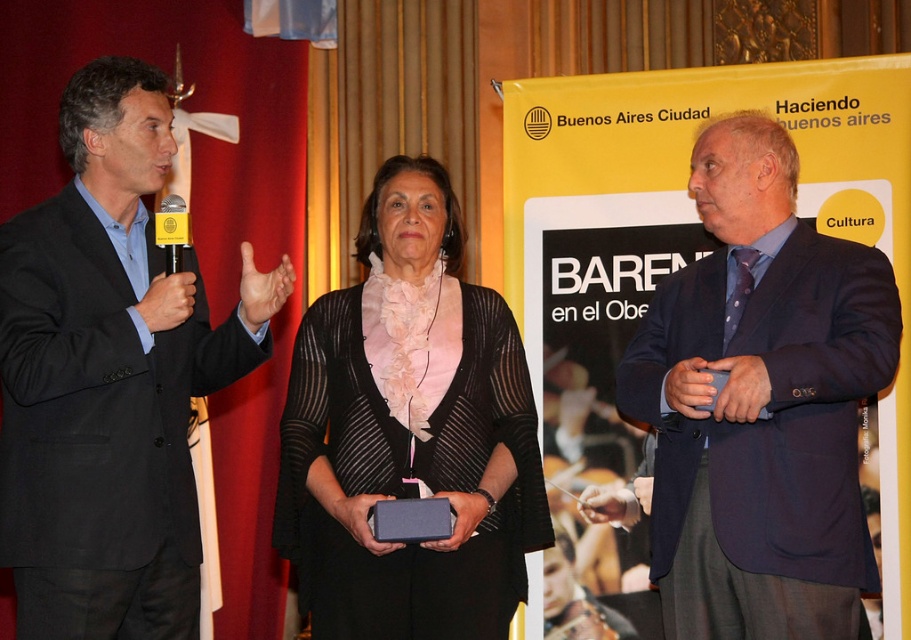
You are attending a formal event and notice two items of interest. The first is the matte black sweater at center, and the second is the yellow plastic microphone at left. Based on their positions, which item is located to the right of the other?

The matte black sweater at center is located to the right of the yellow plastic microphone at left.

Consider the image. You are a photographer at the event and need to adjust your camera focus. Which of the two people at the center, the dark blue suit at center or the matte black sweater at center, is positioned closer to you?

The dark blue suit at center is closer to the viewer than the matte black sweater at center, so you should focus on the dark blue suit at center.

You are standing at the point with coordinates point (x=404, y=454) and want to walk to the point with coordinates point (x=705, y=534). Which direction should you move in relation to the scene?

You should move forward because point (x=705, y=534) is in front of point (x=404, y=454).